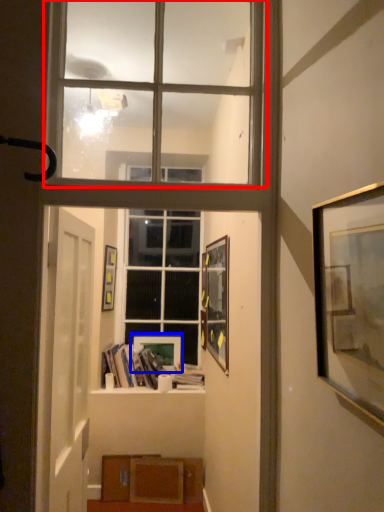
Question: Which of the following is the farthest to the observer, window (highlighted by a red box) or picture frame (highlighted by a blue box)?

Choices:
 (A) window
 (B) picture frame

Answer: (B)